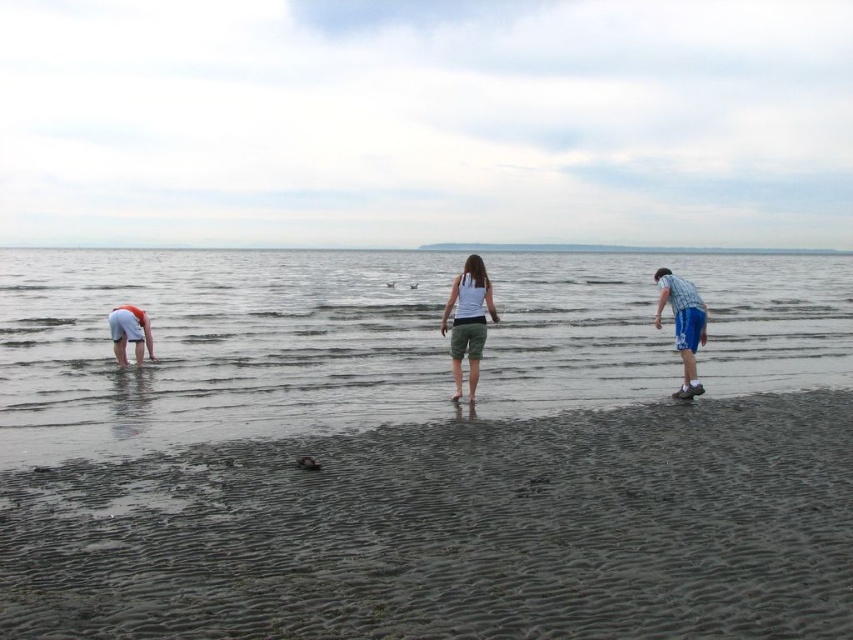
Based on the photo, is white matte shorts at center smaller than white cotton shorts at left?

Incorrect, white matte shorts at center is not smaller in size than white cotton shorts at left.

Does point (473, 362) come behind point (142, 328)?

No, it is in front of (142, 328).

At what (x,y) coordinates should I click in order to perform the action: click on white matte shorts at center. Please return your answer as a coordinate pair (x, y). This screenshot has height=640, width=853. Looking at the image, I should click on (468, 321).

At what (x,y) coordinates should I click in order to perform the action: click on white matte shorts at center. Please return your answer as a coordinate pair (x, y). This screenshot has width=853, height=640. Looking at the image, I should click on (468, 321).

Who is more forward, (802,600) or (485,291)?

Point (802,600)

This screenshot has width=853, height=640. I want to click on dark gray sand at lower center, so click(454, 531).

Locate an element on the screen. dark gray sand at lower center is located at coordinates (454, 531).

Can you confirm if white matte shorts at center is bigger than blue plaid shirt at right?

Correct, white matte shorts at center is larger in size than blue plaid shirt at right.

This screenshot has height=640, width=853. Find the location of `white matte shorts at center`. white matte shorts at center is located at coordinates (468, 321).